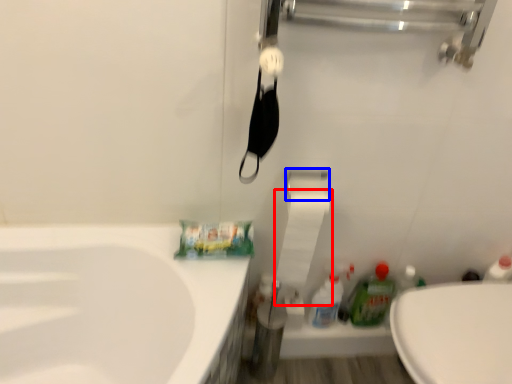
Question: Which of the following is the closest to the observer, toilet paper (highlighted by a red box) or towel bar (highlighted by a blue box)?

Choices:
 (A) toilet paper
 (B) towel bar

Answer: (A)